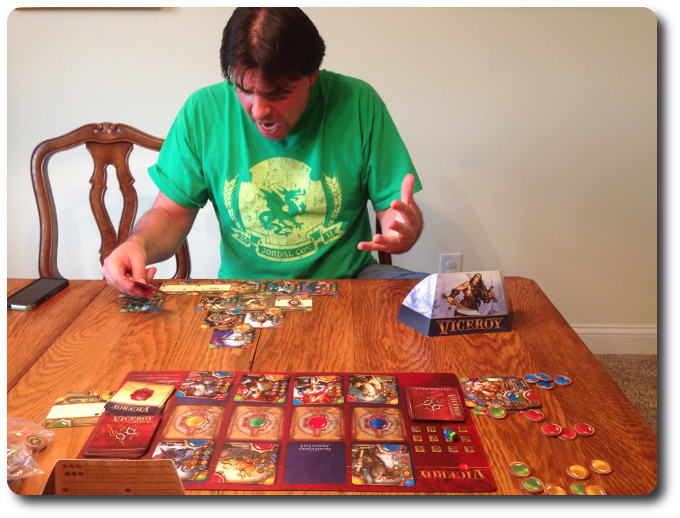
You are a GUI agent. You are given a task and a screenshot of the screen. Output one action in this format:
    pyautogui.click(x=<x>, y=<y>)
    Task: Click on the wall
    The width and height of the screenshot is (680, 518).
    Given the screenshot: What is the action you would take?
    pyautogui.click(x=66, y=68)